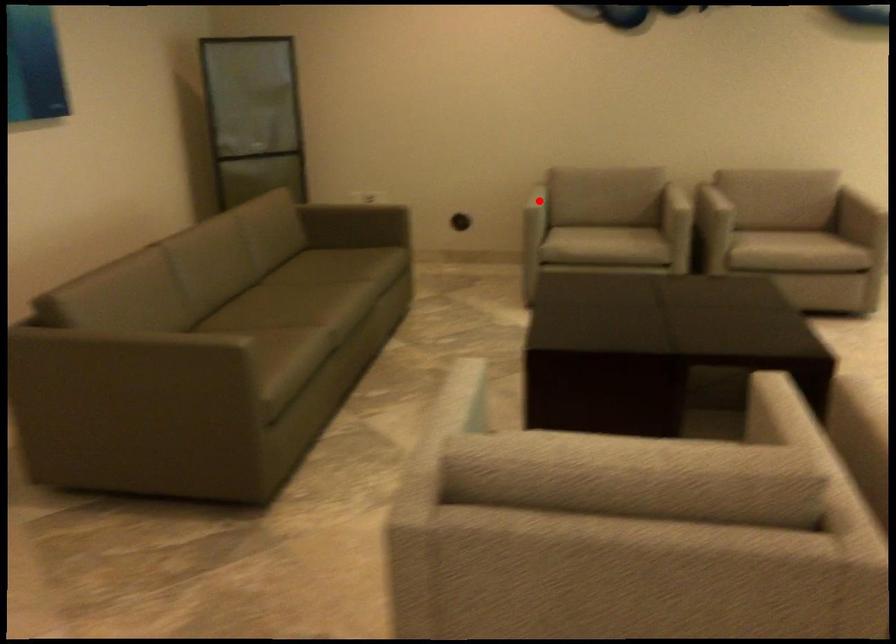
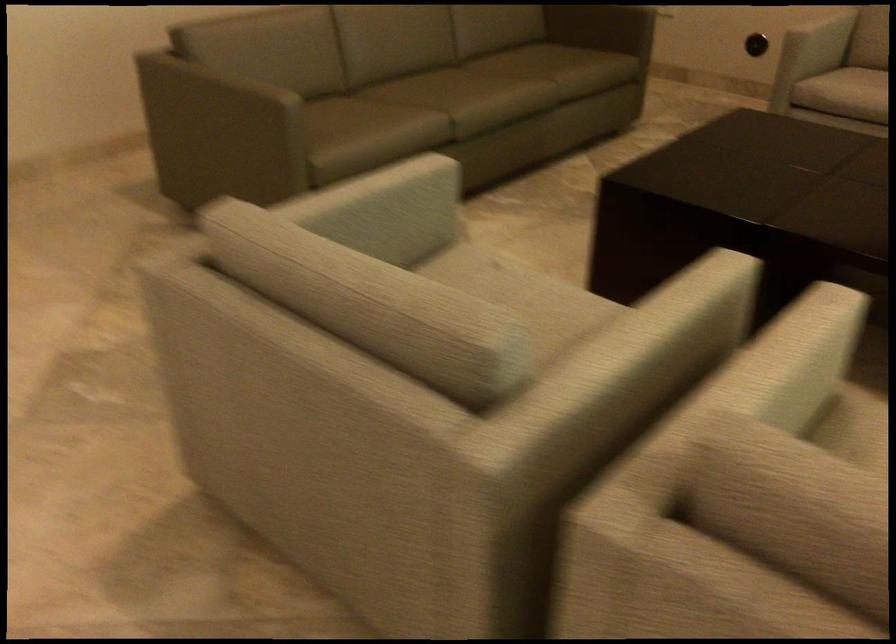
Question: I am providing you with two images of the same scene from different viewpoints. Given a red point in image1, look at the same physical point in image2. Is it:

Choices:
 (A) Closer to the viewpoint
 (B) Farther from the viewpoint

Answer: (A)